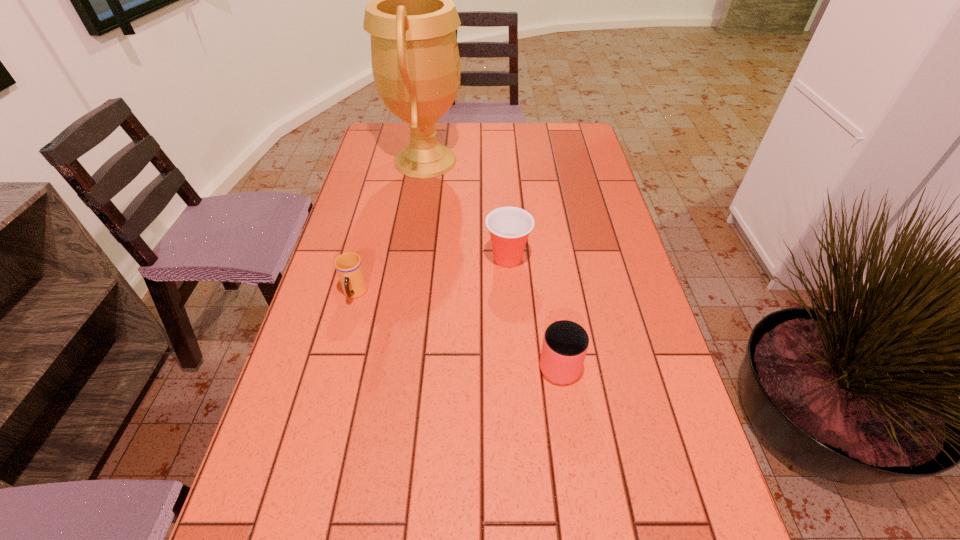
Locate an element on the screen. The width and height of the screenshot is (960, 540). free location located 0.250m on the handle side of the nearest cup is located at coordinates (544, 261).

This screenshot has width=960, height=540. I want to click on vacant space located 0.220m on the side of the third farthest object with the handle, so click(330, 388).

In order to click on object located at the far edge in this screenshot , I will do `click(412, 20)`.

Where is `trophy located at the left edge`? Image resolution: width=960 pixels, height=540 pixels. trophy located at the left edge is located at coordinates (412, 20).

Where is `cup that is at the left edge`? cup that is at the left edge is located at coordinates pyautogui.click(x=349, y=267).

Where is `object present at the far left corner`? The image size is (960, 540). object present at the far left corner is located at coordinates (412, 20).

Find the location of a particular element. This screenshot has height=540, width=960. free space at the far edge of the desktop is located at coordinates (497, 139).

Image resolution: width=960 pixels, height=540 pixels. I want to click on vacant space at the left edge of the desktop, so click(x=348, y=210).

This screenshot has height=540, width=960. Find the location of `blank area at the right edge`. blank area at the right edge is located at coordinates (624, 354).

This screenshot has height=540, width=960. In order to click on vacant area at the far right corner in this screenshot , I will do `click(548, 143)`.